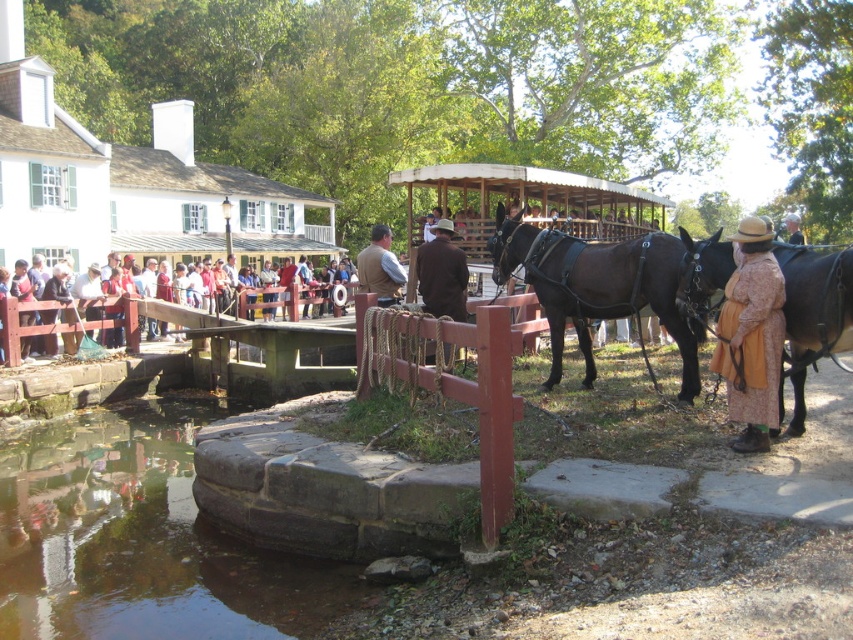
Can you confirm if clear water at bridge lower is positioned above red shirt at center?

Actually, clear water at bridge lower is below red shirt at center.

Does clear water at bridge lower come in front of red shirt at center?

Yes, clear water at bridge lower is closer to the viewer.

Who is more forward, (4, 440) or (4, 307)?

Point (4, 440) is in front.

Find the location of a particular element. clear water at bridge lower is located at coordinates (140, 540).

Can you confirm if red shirt at center is taller than brown woolen hat at upper right?

Incorrect, red shirt at center's height is not larger of brown woolen hat at upper right's.

Can you confirm if red shirt at center is positioned below brown woolen hat at upper right?

Yes, red shirt at center is below brown woolen hat at upper right.

Who is more distant from viewer, (190, 323) or (786, 216)?

Positioned behind is point (786, 216).

Find the location of a particular element. The height and width of the screenshot is (640, 853). red shirt at center is located at coordinates [x=28, y=326].

Which is more to the right, brown textured dress at center right or red shirt at center?

From the viewer's perspective, brown textured dress at center right appears more on the right side.

Based on the photo, does brown textured dress at center right appear on the right side of red shirt at center?

Correct, you'll find brown textured dress at center right to the right of red shirt at center.

Which is in front, point (756, 262) or point (16, 348)?

Point (756, 262)

Locate an element on the screen. The image size is (853, 640). brown textured dress at center right is located at coordinates (751, 336).